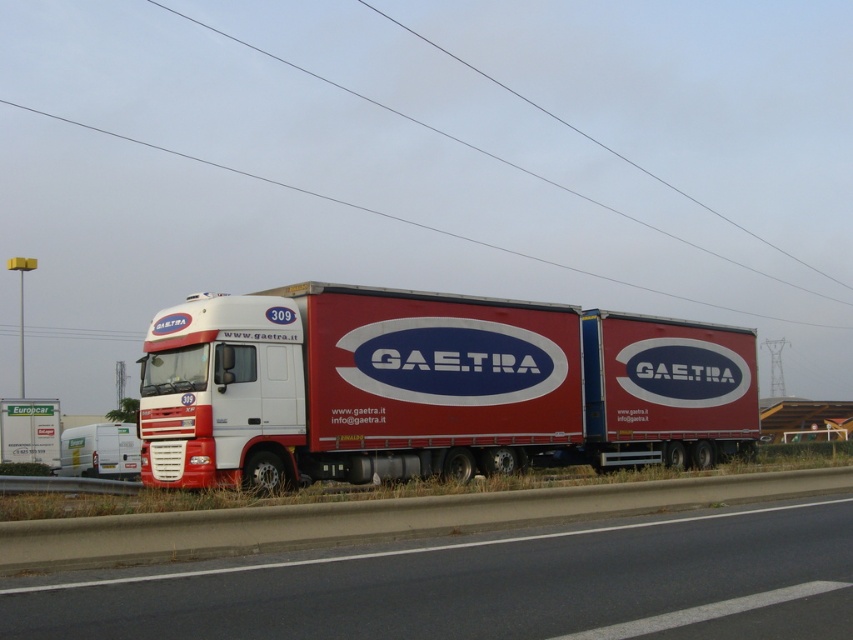
Who is more distant from viewer, (10, 592) or (403, 115)?

The point (403, 115) is more distant.

Does black asphalt highway at center have a smaller size compared to blackcablepower line at upper center?

Yes, black asphalt highway at center is smaller than blackcablepower line at upper center.

Which is behind, point (784, 516) or point (646, 285)?

Positioned behind is point (646, 285).

At what (x,y) coordinates should I click in order to perform the action: click on black asphalt highway at center. Please return your answer as a coordinate pair (x, y). The width and height of the screenshot is (853, 640). Looking at the image, I should click on (486, 586).

Can you confirm if red matte trailer truck at center is smaller than white matte trailer at lower left?

No, red matte trailer truck at center is not smaller than white matte trailer at lower left.

Between red matte trailer truck at center and white matte trailer at lower left, which one is positioned higher?

red matte trailer truck at center is above.

Is point (532, 404) more distant than point (129, 452)?

No, it is not.

Find the location of a particular element. The width and height of the screenshot is (853, 640). red matte trailer truck at center is located at coordinates (430, 388).

Can you confirm if black asphalt highway at center is positioned below white matte trailer at lower left?

Actually, black asphalt highway at center is above white matte trailer at lower left.

I want to click on black asphalt highway at center, so click(x=486, y=586).